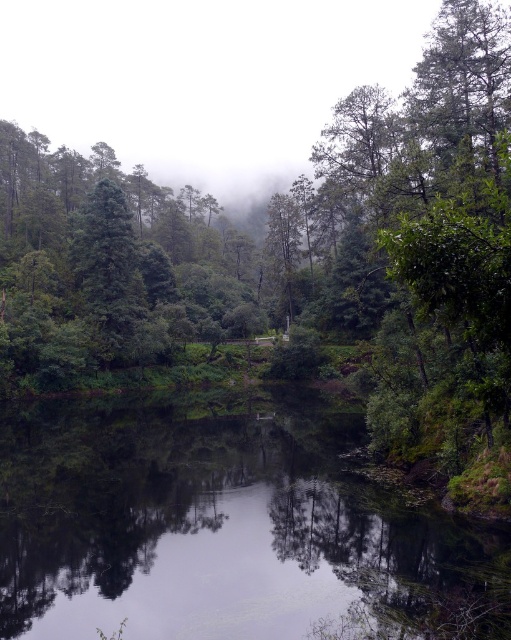
Who is more forward, (50, 554) or (103, 214)?

Point (50, 554) is in front.

Does green reflective water at center appear on the left side of green matte tree at center?

In fact, green reflective water at center is to the right of green matte tree at center.

Between point (213, 435) and point (119, 337), which one is positioned in front?

Positioned in front is point (213, 435).

In order to click on green reflective water at center in this screenshot , I will do `click(220, 529)`.